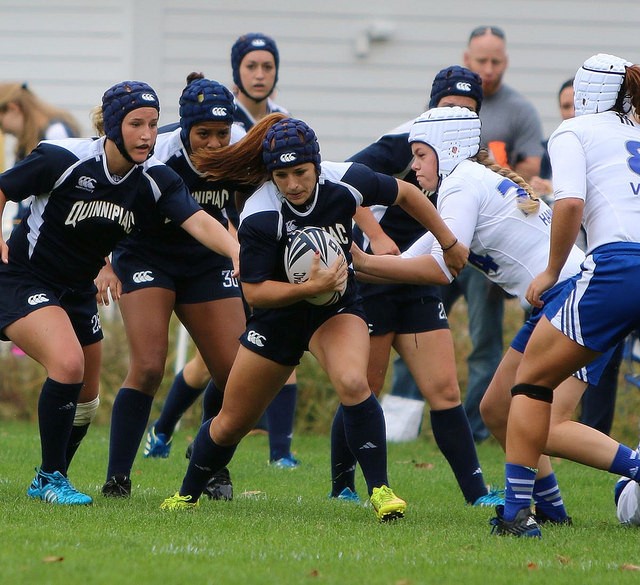
The image size is (640, 585). Find the location of `wall`. wall is located at coordinates (351, 104).